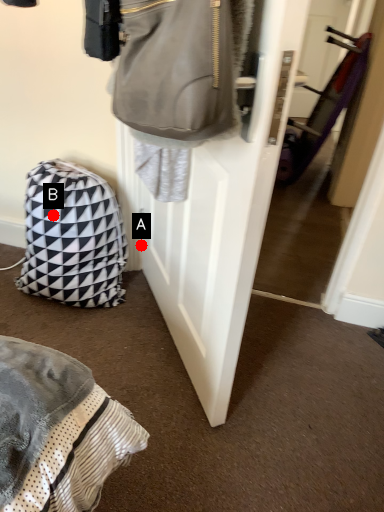
Question: Two points are circled on the image, labeled by A and B beside each circle. Which point is closer to the camera taking this photo?

Choices:
 (A) A is closer
 (B) B is closer

Answer: (B)